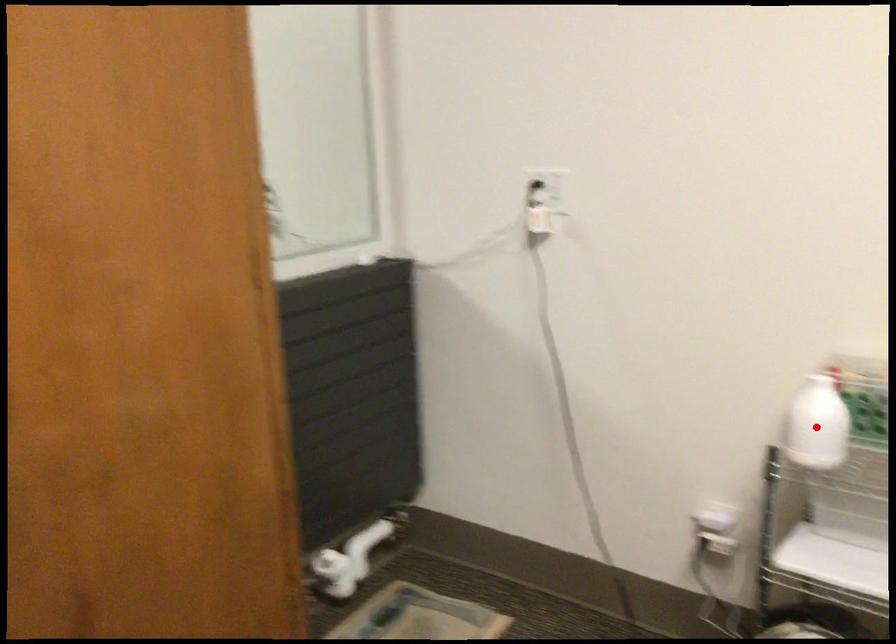
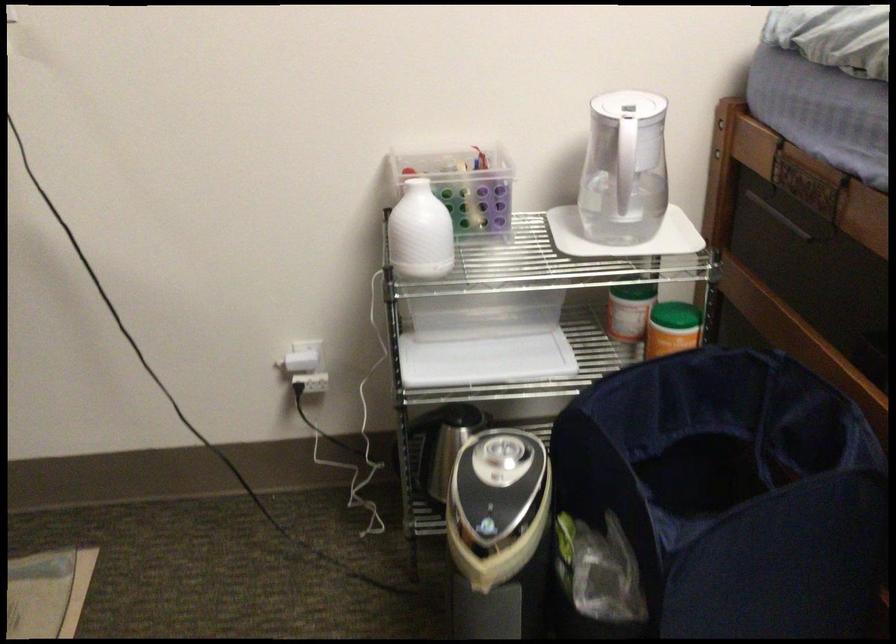
In the second image, find the point that corresponds to the highlighted location in the first image.

(419, 232)